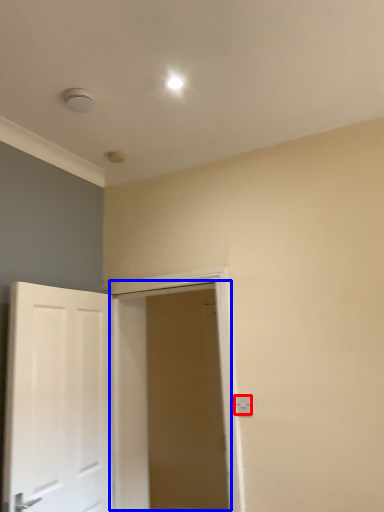
Question: Which object is closer to the camera taking this photo, electric outlet (highlighted by a red box) or door (highlighted by a blue box)?

Choices:
 (A) electric outlet
 (B) door

Answer: (B)